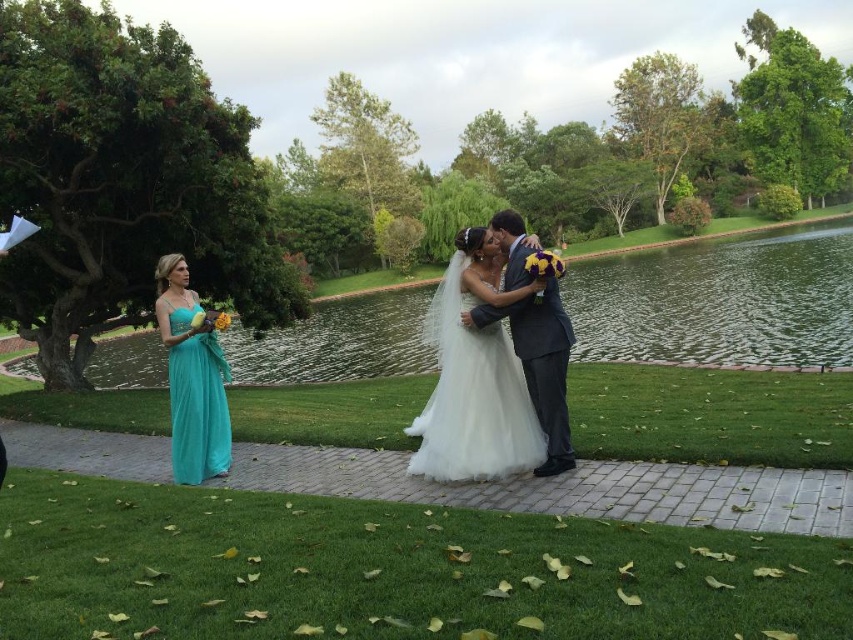
You are planning to take a photo of the couple standing at point (x=215, y=404) and point (x=566, y=420). Which point is closer to the camera?

Point (x=566, y=420) is closer to the camera because point (x=215, y=404) is behind it.

You are standing at the point marked as point (469, 260) in the serene outdoor wedding scene. You want to take a photo of the couple who are standing 6.06 meters away from you. Will you be able to capture them clearly in your shot if your camera has a maximum focus range of 5 meters?

The distance of point (469, 260) from viewer is 6.06 meters, so the camera cannot focus on the couple since the distance exceeds its maximum focus range of 5 meters.

You are a photographer at the wedding and want to capture both the white tulle dress at center and the teal satin dress at left in a single frame. Considering their sizes, which dress might require you to adjust your camera angle to ensure both are fully visible?

The teal satin dress at left occupies more space than the white tulle dress at center, so you might need to adjust your camera angle to accommodate its larger size to ensure both are fully visible.